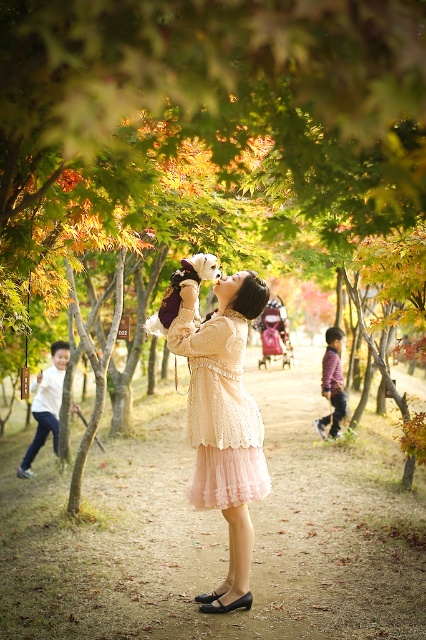
You are planning to walk along the smooth dirt path at center while carrying a large backpack. Considering the size of the lace fabric dress at center, will the path be wide enough for you to walk comfortably without stepping off it?

The smooth dirt path at center is bigger than the lace fabric dress at center, so the path should be wide enough for you to walk comfortably while carrying the backpack, as it is larger than the dress.

You are a hiker who wants to walk along the smooth dirt path at center while avoiding the lace fabric dress at center. Which direction should you move relative to the dress?

The smooth dirt path at center is to the left of the lace fabric dress at center, so you should move to the left relative to the dress to reach the path.